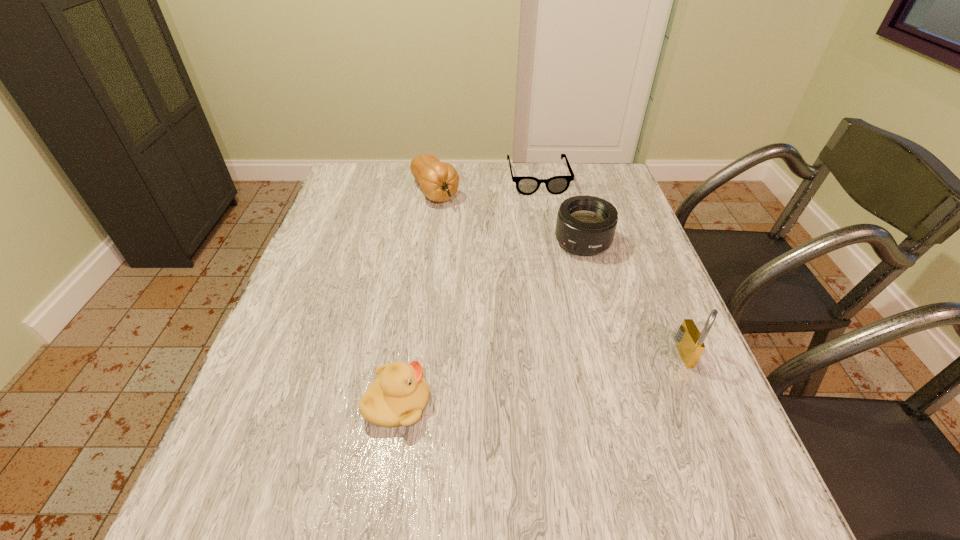
This screenshot has width=960, height=540. Identify the location of free location located 0.270m on the side of the third farthest object with brand markings and control switches. (539, 329).

Locate an element on the screen. blank space located on the side of the third farthest object with brand markings and control switches is located at coordinates (530, 346).

This screenshot has width=960, height=540. Find the location of `vacant region located on the side of the third farthest object with brand markings and control switches`. vacant region located on the side of the third farthest object with brand markings and control switches is located at coordinates (521, 363).

The height and width of the screenshot is (540, 960). Find the location of `vacant area located on the arms of the spectacles`. vacant area located on the arms of the spectacles is located at coordinates (558, 256).

Image resolution: width=960 pixels, height=540 pixels. What are the coordinates of `vacant area located 0.240m on the arms of the spectacles` in the screenshot? It's located at (555, 244).

Locate an element on the screen. The height and width of the screenshot is (540, 960). vacant space situated 0.140m on the arms of the spectacles is located at coordinates (549, 222).

At what (x,y) coordinates should I click in order to perform the action: click on gourd located at the far edge. Please return your answer as a coordinate pair (x, y). This screenshot has height=540, width=960. Looking at the image, I should click on (439, 181).

Identify the location of spectacles that is at the far edge. (526, 185).

Where is `object that is at the near edge`? The height and width of the screenshot is (540, 960). object that is at the near edge is located at coordinates [x=398, y=396].

At what (x,y) coordinates should I click in order to perform the action: click on padlock present at the right edge. Please return your answer as a coordinate pair (x, y). Looking at the image, I should click on (690, 342).